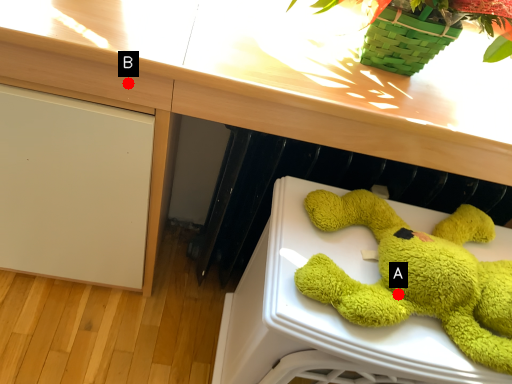
Question: Two points are circled on the image, labeled by A and B beside each circle. Which point is farther from the camera taking this photo?

Choices:
 (A) A is further
 (B) B is further

Answer: (B)